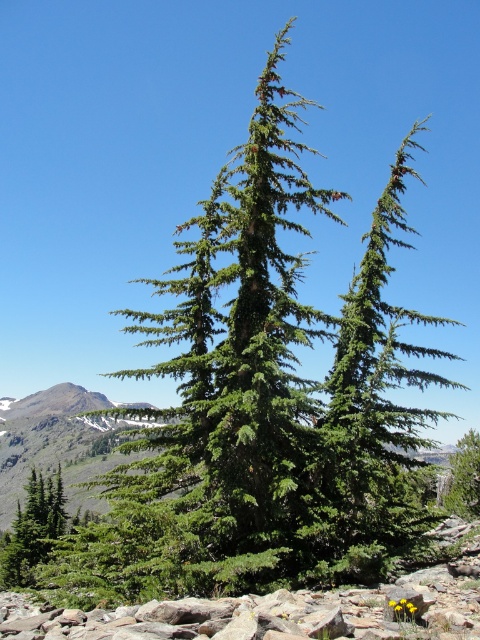
You are standing at the point marked by the coordinates point (58, 444) in the image. What object is directly beneath your feet?

The point (58, 444) marks green coniferous tree at center, so the object directly beneath your feet is the green coniferous tree at center.